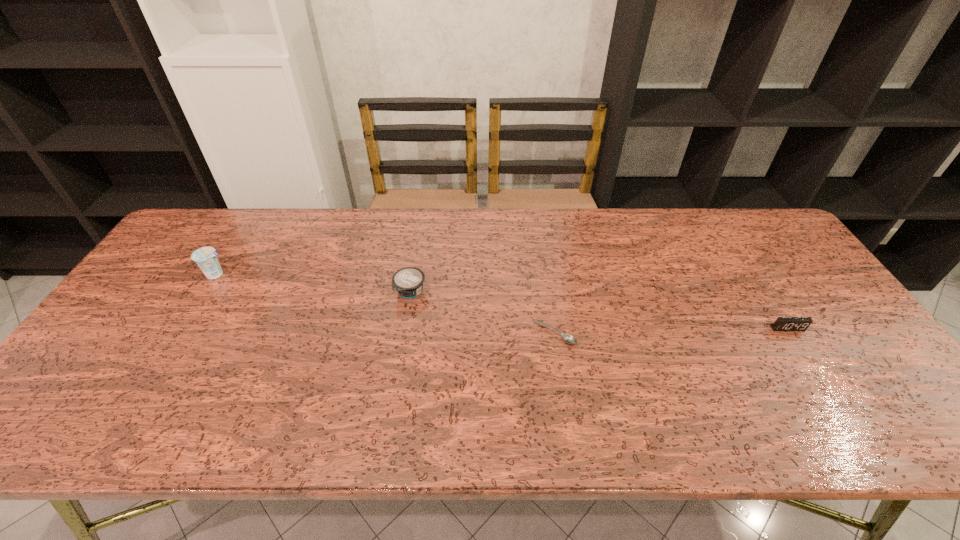
You are a GUI agent. You are given a task and a screenshot of the screen. Output one action in this format:
    pyautogui.click(x=<x>, y=<y>)
    Task: Click on the tallest object
    
    Given the screenshot: What is the action you would take?
    pyautogui.click(x=205, y=257)

At what (x,y) coordinates should I click in order to perform the action: click on the taller yogurt. Please return your answer as a coordinate pair (x, y). The height and width of the screenshot is (540, 960). Looking at the image, I should click on (205, 257).

Where is `the right yogurt`? This screenshot has width=960, height=540. the right yogurt is located at coordinates (408, 282).

In order to click on the third shortest object in this screenshot , I will do `click(408, 282)`.

I want to click on the rightmost object, so click(x=782, y=323).

This screenshot has height=540, width=960. I want to click on the second shortest object, so click(782, 323).

Find the location of a particular element. Image resolution: width=960 pixels, height=540 pixels. soupspoon is located at coordinates (569, 339).

Where is `the shortest object`? The height and width of the screenshot is (540, 960). the shortest object is located at coordinates (569, 339).

I want to click on vacant space located on the back of the left yogurt, so click(x=252, y=218).

The width and height of the screenshot is (960, 540). I want to click on vacant space situated 0.220m on the right of the shorter yogurt, so click(503, 292).